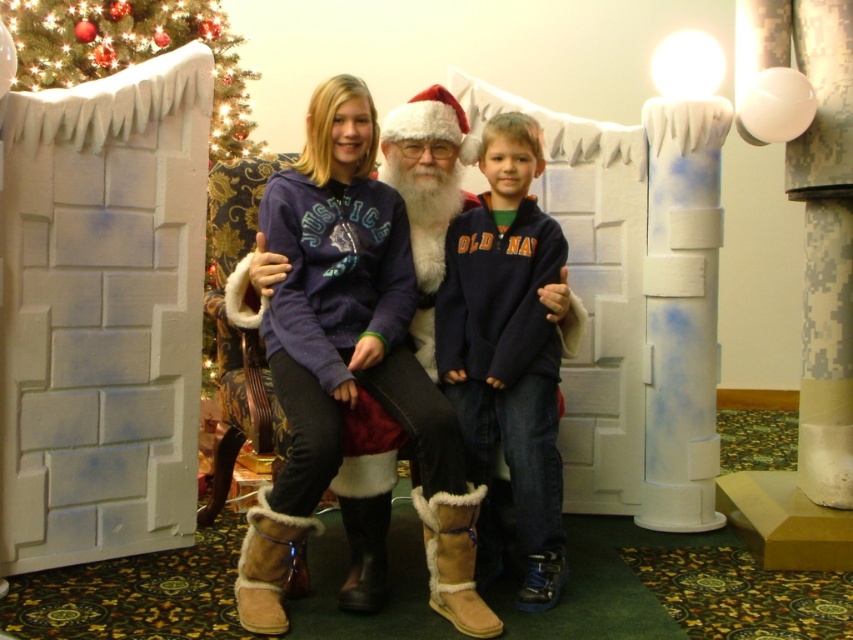
Question: In this image, where is navy fleece sweatshirt at center located relative to green artificial christmas tree at upper left?

Choices:
 (A) left
 (B) right

Answer: (B)

Question: Which point is closer to the camera?

Choices:
 (A) white painted wood pillar at right
 (B) green artificial christmas tree at upper left
 (C) brown suede boots at center

Answer: (C)

Question: Is brown suede boots at center to the left of green artificial christmas tree at upper left from the viewer's perspective?

Choices:
 (A) yes
 (B) no

Answer: (B)

Question: Is brown suede boots at center smaller than navy fleece sweatshirt at center?

Choices:
 (A) yes
 (B) no

Answer: (B)

Question: Which object is the closest to the green artificial christmas tree at upper left?

Choices:
 (A) navy fleece sweatshirt at center
 (B) white painted wood pillar at right

Answer: (A)

Question: Which is farther from the white painted wood pillar at right?

Choices:
 (A) green artificial christmas tree at upper left
 (B) navy fleece sweatshirt at center
 (C) brown suede boots at center

Answer: (A)